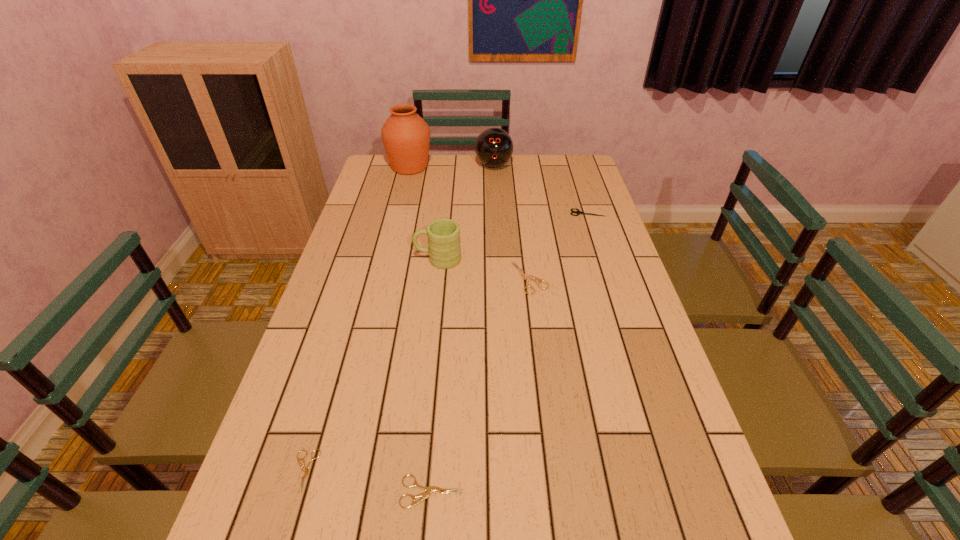
In the image, there is a desktop. Identify the location of free space at the left edge. This screenshot has width=960, height=540. (383, 239).

In the image, there is a desktop. Identify the location of vacant space at the right edge. (578, 207).

Identify the location of free space at the far right corner. This screenshot has height=540, width=960. (561, 181).

Find the location of a particular element. The width and height of the screenshot is (960, 540). free space that is in between the smallest beige shears and the black bowling ball is located at coordinates (399, 319).

Where is `vacant space that is in between the third nearest shears and the mug`? vacant space that is in between the third nearest shears and the mug is located at coordinates point(484,268).

Where is `vacant region between the second shears from right to left and the bowling ball`? The width and height of the screenshot is (960, 540). vacant region between the second shears from right to left and the bowling ball is located at coordinates (512, 221).

The width and height of the screenshot is (960, 540). What are the coordinates of `empty space that is in between the brown urn and the third tallest object` in the screenshot? It's located at coord(423,213).

Identify the location of vacant space in between the mug and the leftmost shears. (372, 366).

Locate an element on the screen. The image size is (960, 540). free space between the farthest shears and the smallest beige shears is located at coordinates (445, 342).

The width and height of the screenshot is (960, 540). I want to click on free spot between the rightmost shears and the brown urn, so click(x=498, y=190).